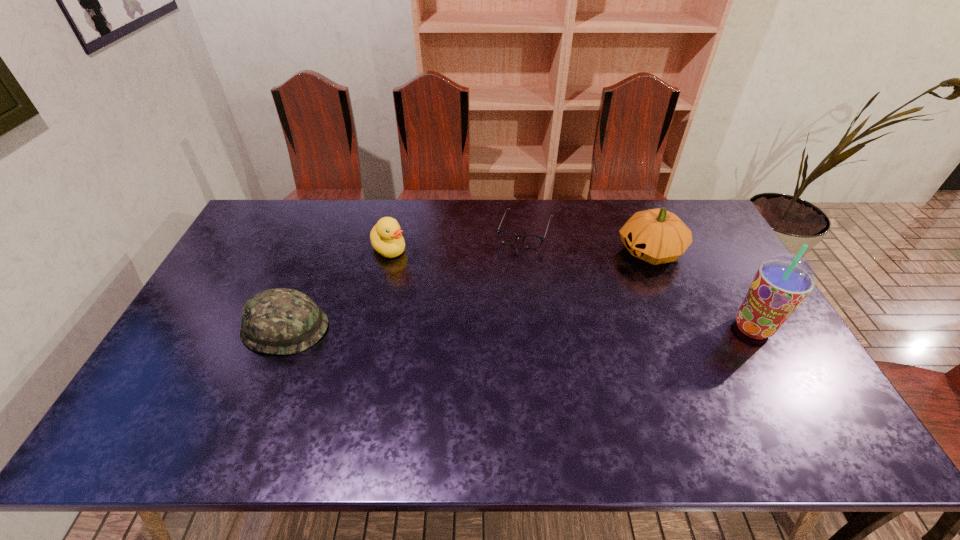
Where is `free spot on the desktop that is between the headwear and the smoothie and is positioned through the lenses of the spectacles`? free spot on the desktop that is between the headwear and the smoothie and is positioned through the lenses of the spectacles is located at coordinates pos(492,328).

Find the location of a particular element. The width and height of the screenshot is (960, 540). free space on the desktop that is between the leftmost object and the tallest object and is positioned at the beak of the fourth object from right to left is located at coordinates (467, 328).

The image size is (960, 540). What are the coordinates of `vacant space on the desktop that is between the headwear and the rightmost object and is positioned on the side of the fourth object from left to right with the carved face` in the screenshot? It's located at (494, 328).